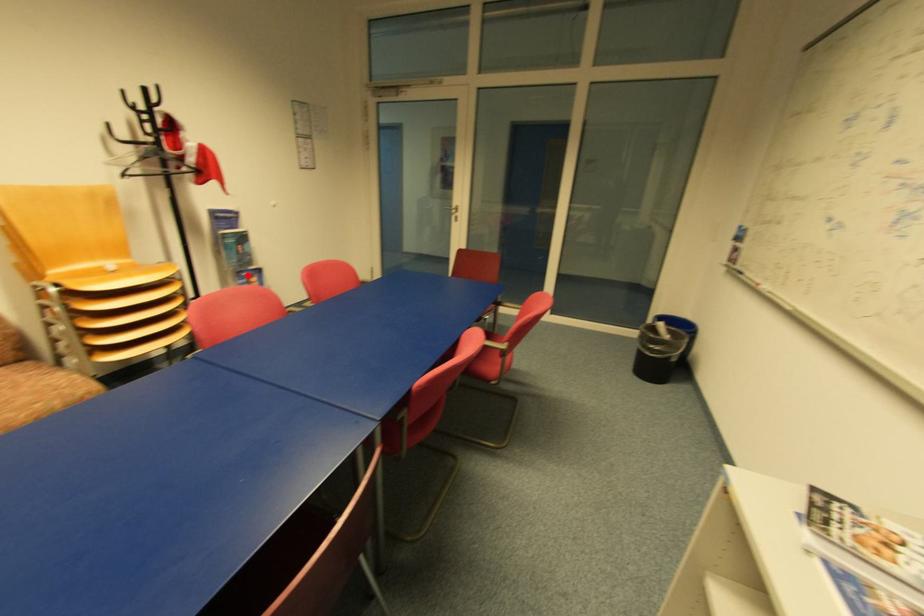
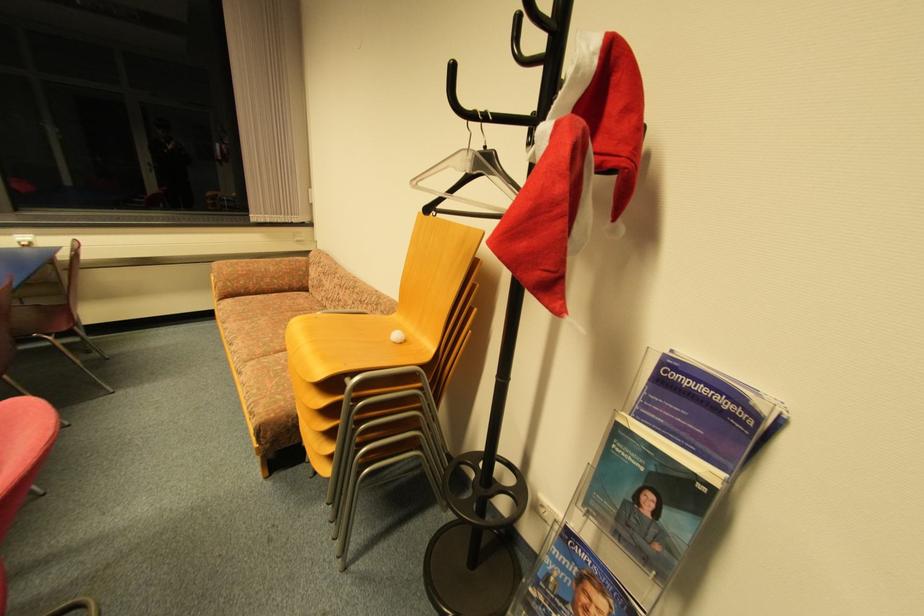
Question: I am providing you with two images of the same scene from different viewpoints. A red point is shown in image1. For the corresponding object point in image2, is it positioned nearer or farther from the camera?

Choices:
 (A) Nearer
 (B) Farther

Answer: (B)